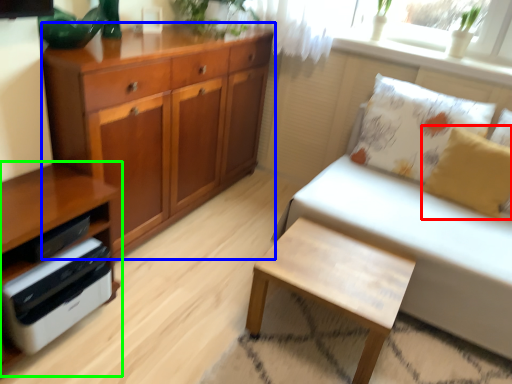
Question: Considering the real-world distances, which object is farthest from pillow (highlighted by a red box)? chest of drawers (highlighted by a blue box) or cabinetry (highlighted by a green box)?

Choices:
 (A) chest of drawers
 (B) cabinetry

Answer: (B)